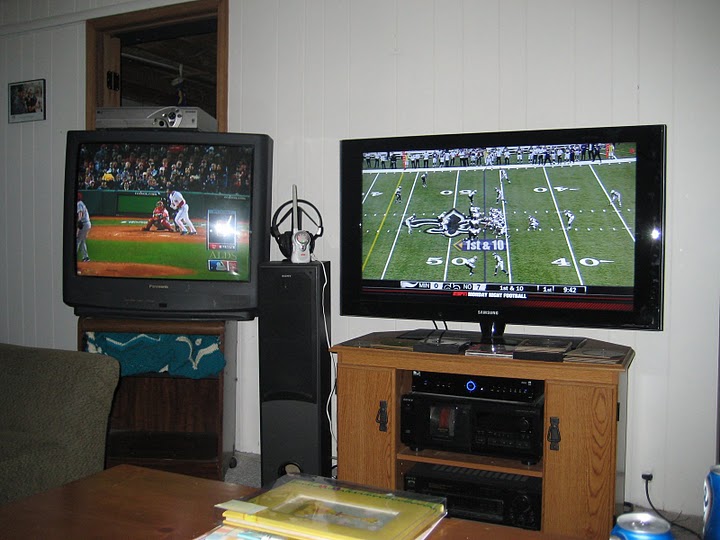
At what (x,y) coordinates should I click in order to perform the action: click on tv stand. Please return your answer as a coordinate pair (x, y). The height and width of the screenshot is (540, 720). Looking at the image, I should click on (492, 367).